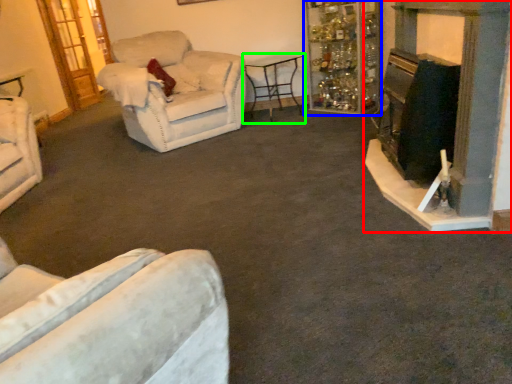
Question: Considering the real-world distances, which object is farthest from fireplace (highlighted by a red box)? shelf (highlighted by a blue box) or table (highlighted by a green box)?

Choices:
 (A) shelf
 (B) table

Answer: (B)